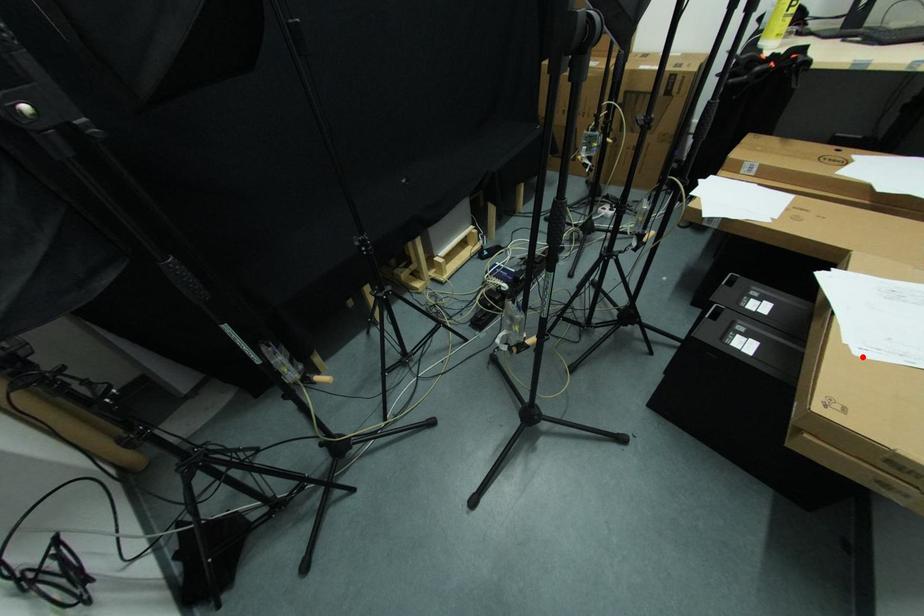
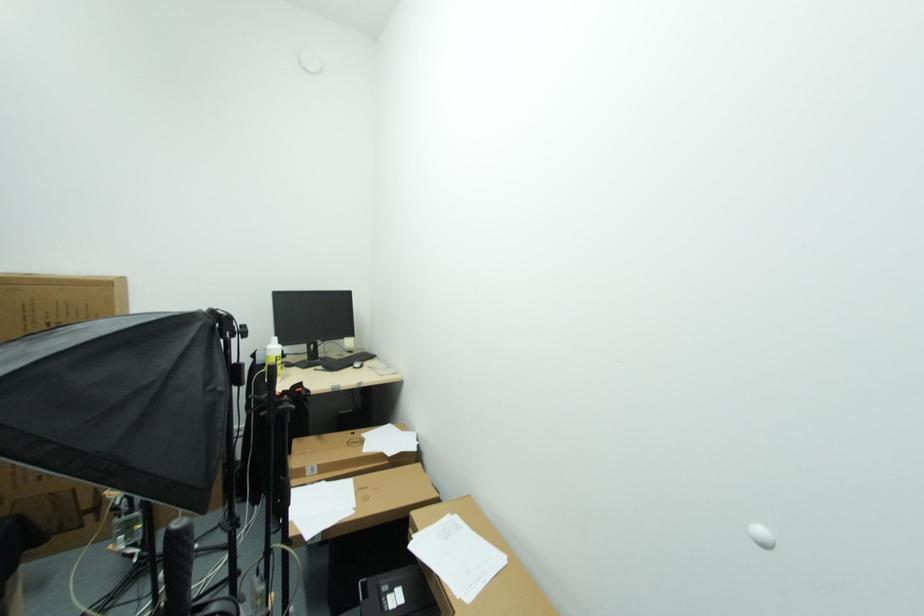
In the second image, find the point that corresponds to the highlighted location in the first image.

(470, 602)